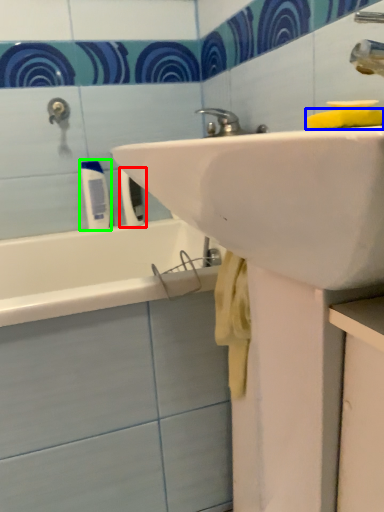
Question: Estimate the real-world distances between objects in this image. Which object is farther from toiletry (highlighted by a red box), soap (highlighted by a blue box) or toiletry (highlighted by a green box)?

Choices:
 (A) soap
 (B) toiletry

Answer: (A)